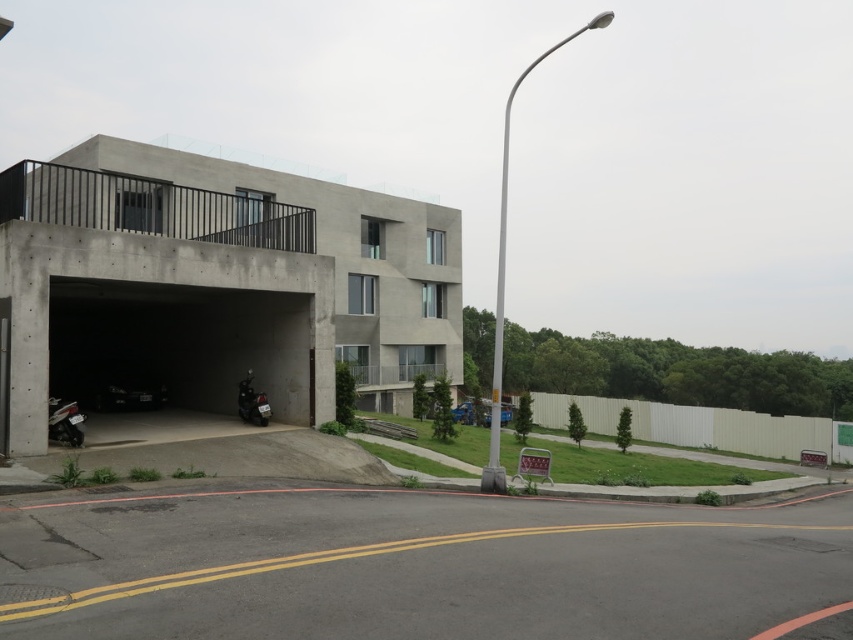
You are standing at the entrance of the building and want to walk to the point marked as point (257, 397). There is an obstacle at point (167, 218). Will you encounter this obstacle before reaching your destination?

Yes, you will encounter the obstacle at point (167, 218) before reaching point (257, 397) because point (167, 218) is closer to you than point (257, 397).

You are standing at the entrance of the parking area and want to walk towards the point labeled as point (392,368). As you walk, you notice another point labeled point (79,435). Which point will you encounter first?

You will encounter point (79,435) first because it is in front of point (392,368) according to their spatial arrangement.